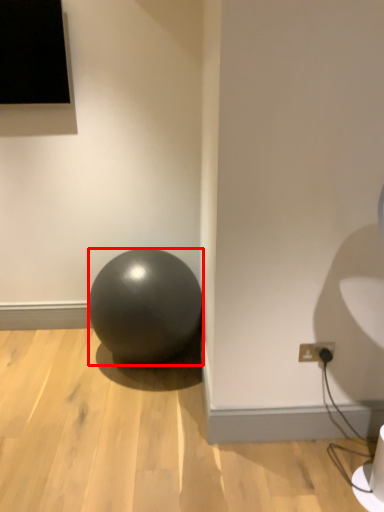
Question: In this image, where is ball (annotated by the red box) located relative to electric outlet?

Choices:
 (A) left
 (B) right

Answer: (A)